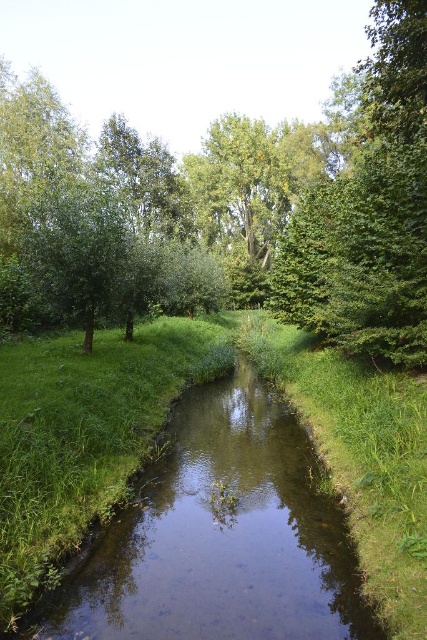
From the picture: Is green grassy stream at center to the left of green leafy tree at upper right from the viewer's perspective?

Yes, green grassy stream at center is to the left of green leafy tree at upper right.

Which is in front, point (262, 593) or point (303, 291)?

Point (262, 593) is in front.

Where is `green grassy stream at center`? This screenshot has width=427, height=640. green grassy stream at center is located at coordinates (221, 536).

Which is more to the right, green leafy tree at center or green grassy stream at center?

green leafy tree at center is more to the right.

Is green leafy tree at center behind green grassy stream at center?

Yes, it is behind green grassy stream at center.

Locate an element on the screen. This screenshot has width=427, height=640. green leafy tree at center is located at coordinates (243, 198).

Which is in front, point (47, 168) or point (421, 292)?

Point (421, 292) is more forward.

Is green leafy tree at center above green leafy tree at upper right?

Correct, green leafy tree at center is located above green leafy tree at upper right.

The width and height of the screenshot is (427, 640). Describe the element at coordinates (243, 198) in the screenshot. I see `green leafy tree at center` at that location.

What are the coordinates of `green leafy tree at center` in the screenshot? It's located at (243, 198).